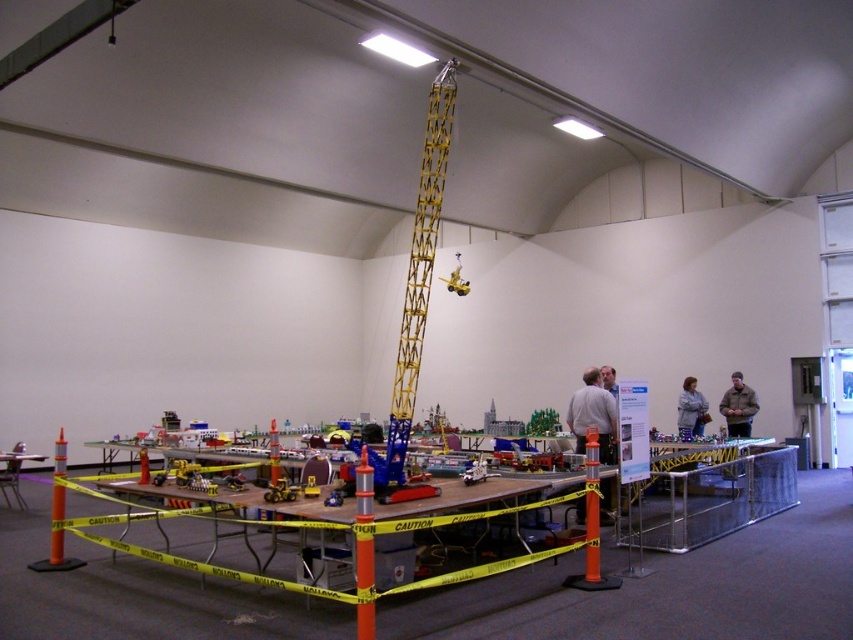
Is point (730, 413) positioned after point (677, 410)?

No, (730, 413) is in front of (677, 410).

Find the location of a particular element. Image resolution: width=853 pixels, height=640 pixels. brown fuzzy jacket at lower right is located at coordinates (738, 406).

Between light gray shirt at center and light gray fabric jacket at center right, which one has less height?

Standing shorter between the two is light gray fabric jacket at center right.

Can you confirm if light gray shirt at center is positioned below light gray fabric jacket at center right?

Actually, light gray shirt at center is above light gray fabric jacket at center right.

Between point (572, 426) and point (693, 385), which one is positioned behind?

Point (693, 385)

Find the location of a particular element. The width and height of the screenshot is (853, 640). light gray shirt at center is located at coordinates (593, 416).

Who is shorter, orange reflective cone at center or wooden table at lower left?

Standing shorter between the two is wooden table at lower left.

Is orange reflective cone at center thinner than wooden table at lower left?

Yes, orange reflective cone at center is thinner than wooden table at lower left.

Is point (370, 580) less distant than point (0, 451)?

Yes, it is.

In order to click on orange reflective cone at center in this screenshot , I will do `click(364, 548)`.